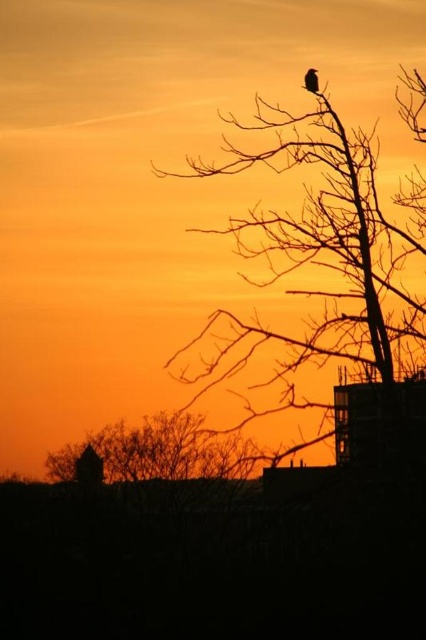
Question: Which of the following is the farthest from the observer?

Choices:
 (A) silhouette bare tree at upper right
 (B) silhouette feathered bird at upper center
 (C) brown/rough tree at lower center

Answer: (C)

Question: Which is farther from the silhouette bare tree at upper right?

Choices:
 (A) silhouette feathered bird at upper center
 (B) brown/rough tree at lower center

Answer: (B)

Question: Does brown/rough tree at lower center appear on the left side of silhouette feathered bird at upper center?

Choices:
 (A) yes
 (B) no

Answer: (A)

Question: Which object is positioned closest to the silhouette feathered bird at upper center?

Choices:
 (A) silhouette bare tree at upper right
 (B) brown/rough tree at lower center

Answer: (A)

Question: Is silhouette bare tree at upper right positioned behind silhouette feathered bird at upper center?

Choices:
 (A) no
 (B) yes

Answer: (A)

Question: Does brown/rough tree at lower center have a greater width compared to silhouette feathered bird at upper center?

Choices:
 (A) no
 (B) yes

Answer: (B)